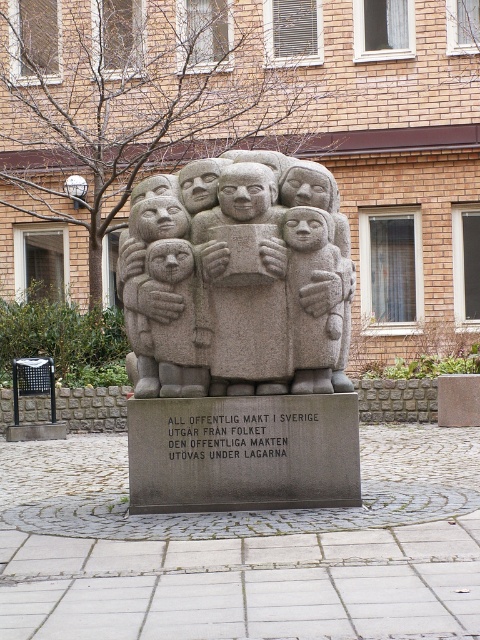
Is point (153, 192) in front of point (325, 262)?

No.

The width and height of the screenshot is (480, 640). What are the coordinates of `granite sculpture at center` in the screenshot? It's located at (239, 280).

Which is above, granite statue at center or gray stone child at center?

granite statue at center is higher up.

Is granite statue at center smaller than gray stone child at center?

No.

This screenshot has width=480, height=640. I want to click on granite statue at center, so click(x=244, y=282).

Is point (276, 198) closer to viewer compared to point (267, 337)?

No, it is not.

Does point (204, 305) lie in front of point (257, 208)?

No, it is behind (257, 208).

Identify the location of granite sculpture at center. The image size is (480, 640). (239, 280).